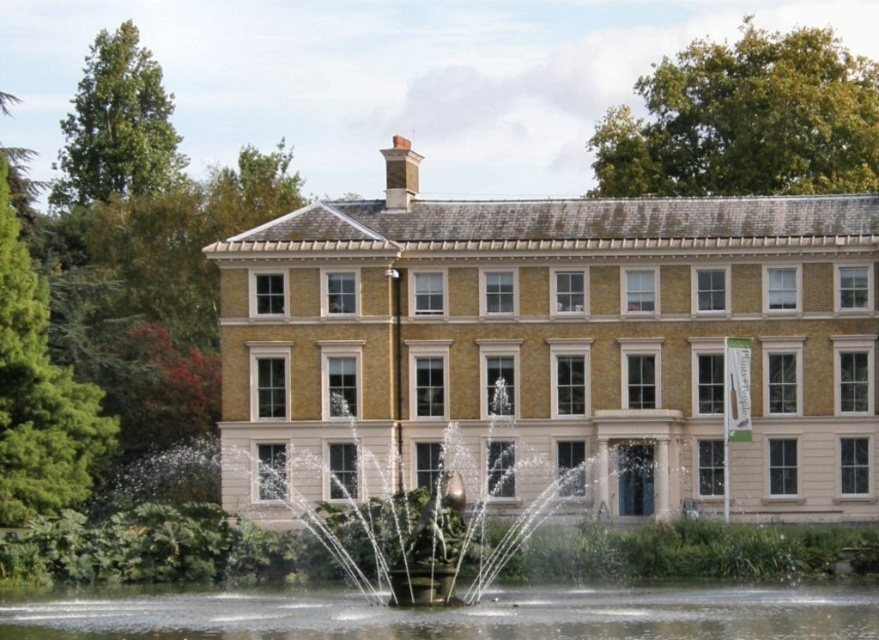
Question: Which object is closer to the camera taking this photo?

Choices:
 (A) beige stone mansion at center
 (B) clear water at center

Answer: (B)

Question: Does beige stone mansion at center lie behind bronze fountain at center?

Choices:
 (A) yes
 (B) no

Answer: (A)

Question: Can you confirm if beige stone mansion at center is positioned below bronze fountain at center?

Choices:
 (A) no
 (B) yes

Answer: (A)

Question: Which point is farther from the camera taking this photo?

Choices:
 (A) (303, 458)
 (B) (721, 598)

Answer: (A)

Question: Is beige stone mansion at center wider than clear water at center?

Choices:
 (A) no
 (B) yes

Answer: (A)

Question: Among these points, which one is nearest to the camera?

Choices:
 (A) (587, 470)
 (B) (498, 349)

Answer: (A)